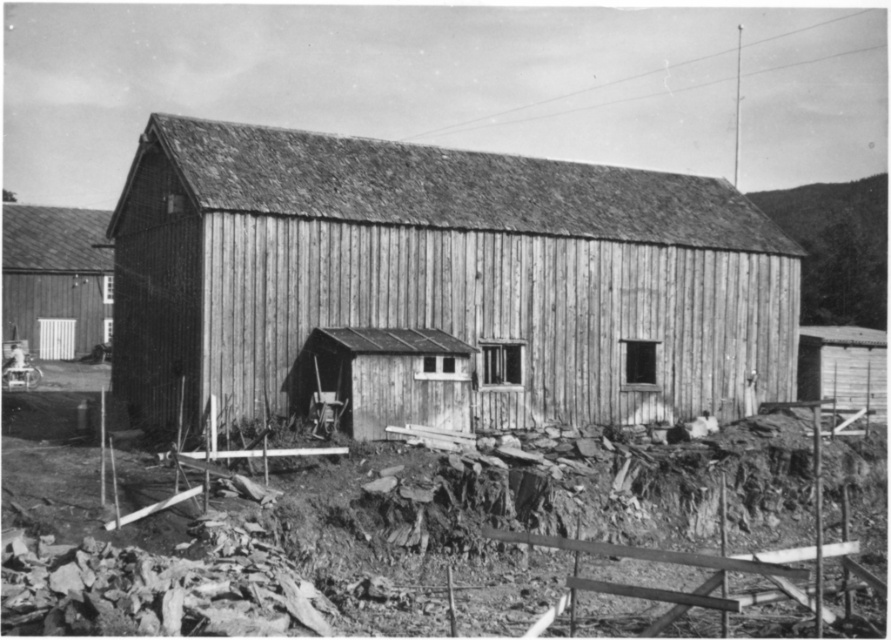
Question: Which of the following is the farthest from the observer?

Choices:
 (A) (562, 304)
 (B) (217, 634)

Answer: (A)

Question: Based on their relative distances, which object is nearer to the wooden hut at center?

Choices:
 (A) rusty metal debris at lower left
 (B) smooth wooden door at left

Answer: (A)

Question: Can you confirm if rusty metal debris at lower left is smaller than smooth wooden door at left?

Choices:
 (A) yes
 (B) no

Answer: (B)

Question: Can you confirm if rusty metal debris at lower left is positioned above smooth wooden door at left?

Choices:
 (A) no
 (B) yes

Answer: (A)

Question: Which is nearer to the wooden hut at center?

Choices:
 (A) smooth wooden door at left
 (B) rusty metal debris at lower left

Answer: (B)

Question: Is wooden hut at center to the left of smooth wooden door at left from the viewer's perspective?

Choices:
 (A) no
 (B) yes

Answer: (A)